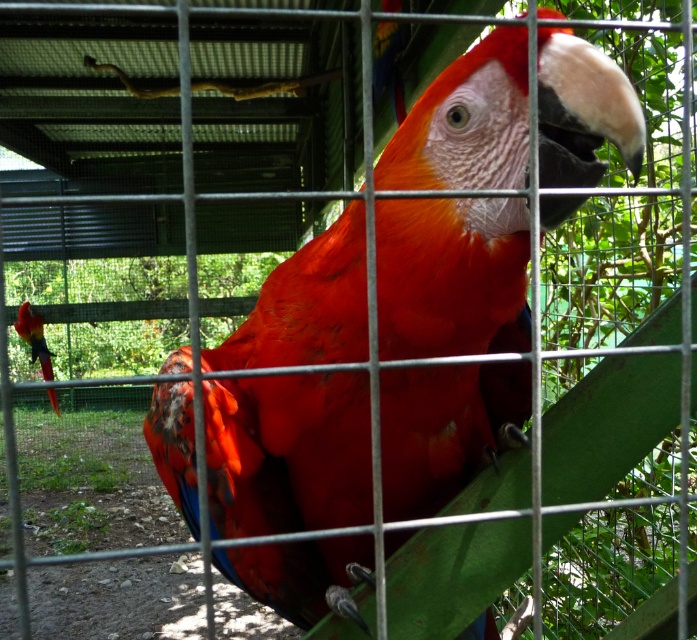
Question: Does glossy feathers parrot at center have a larger size compared to shiny red parrot at left?

Choices:
 (A) yes
 (B) no

Answer: (B)

Question: Which point is farther to the camera?

Choices:
 (A) glossy feathers parrot at center
 (B) shiny red parrot at left

Answer: (B)

Question: Can you confirm if glossy feathers parrot at center is smaller than shiny red parrot at left?

Choices:
 (A) no
 (B) yes

Answer: (B)

Question: Which of the following is the closest to the observer?

Choices:
 (A) glossy feathers parrot at center
 (B) shiny red parrot at left

Answer: (A)

Question: Does glossy feathers parrot at center have a smaller size compared to shiny red parrot at left?

Choices:
 (A) no
 (B) yes

Answer: (B)